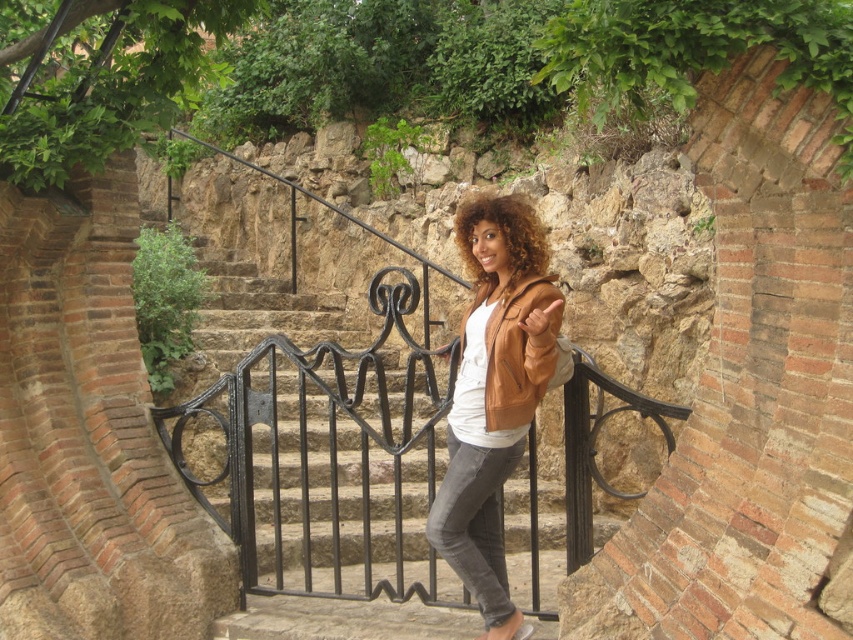
You are a photographer trying to capture the person in the image. Since the brown leather jacket at center and curly golden hair at center are both at the center, which one should you focus on to ensure the subject is in focus?

The brown leather jacket at center is much taller than curly golden hair at center, so focusing on the brown leather jacket at center will ensure the subject is in focus.

You are a photographer trying to capture the person in the image. If you focus on the brown leather jacket at center, will the curly golden hair at center also be in focus? Explain why based on their positions.

The brown leather jacket at center is closer to the viewer than the curly golden hair at center. Since the jacket is in focus, the hair, being further away, may not be in focus depending on the camera settings. However, in most cases with such a small distance, both might be in focus. But strictly based on position, the hair is farther so might be slightly out of focus.